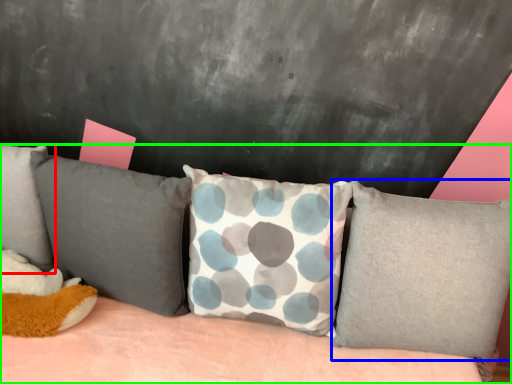
Question: Estimate the real-world distances between objects in this image. Which object is closer to pillow (highlighted by a red box), pillow (highlighted by a blue box) or studio couch (highlighted by a green box)?

Choices:
 (A) pillow
 (B) studio couch

Answer: (B)